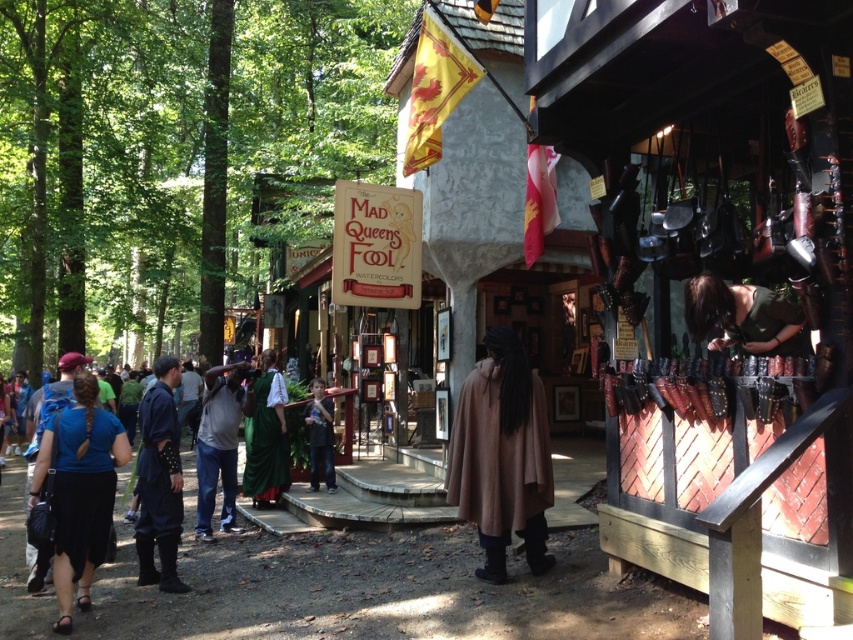
Question: Which point appears farthest from the camera in this image?

Choices:
 (A) (21, 620)
 (B) (496, 483)
 (C) (224, 380)

Answer: (C)

Question: Which of the following is the closest to the observer?

Choices:
 (A) matte brown leather bag at center
 (B) dark blue fabric coat at center

Answer: (B)

Question: Which of the following is the closest to the observer?

Choices:
 (A) (331, 428)
 (B) (131, 593)
 (C) (83, 518)
 (D) (257, 502)

Answer: (C)

Question: Does blue cotton shirt at center have a larger size compared to denim pants at center?

Choices:
 (A) yes
 (B) no

Answer: (B)

Question: Does denim pants at center have a greater width compared to green velvet dress at center?

Choices:
 (A) yes
 (B) no

Answer: (A)

Question: Can you confirm if green matte shirt at upper right is smaller than denim pants at center?

Choices:
 (A) no
 (B) yes

Answer: (B)